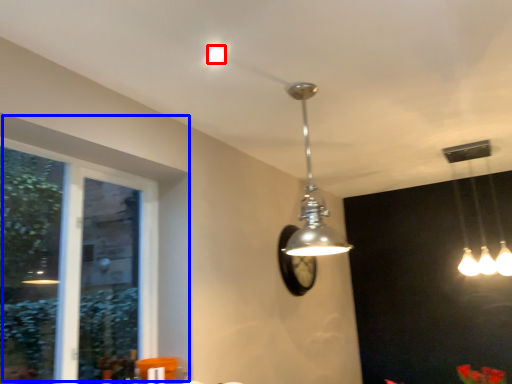
Question: Among these objects, which one is nearest to the camera, droplight (highlighted by a red box) or window (highlighted by a blue box)?

Choices:
 (A) droplight
 (B) window

Answer: (B)